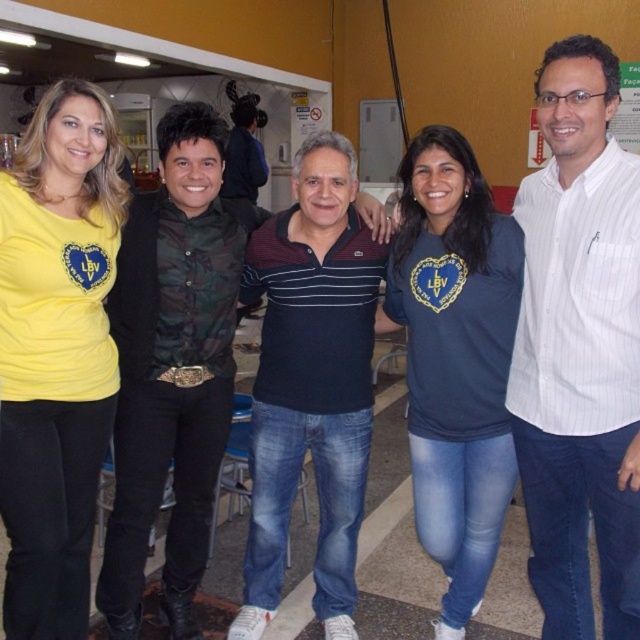
Question: In this image, where is white striped shirt at center located relative to yellow matte shirt at left?

Choices:
 (A) below
 (B) above

Answer: (B)

Question: Is white striped shirt at center wider than camouflage fabric shirt at left?

Choices:
 (A) yes
 (B) no

Answer: (B)

Question: Does camouflage fabric shirt at left appear on the left side of dark blue t-shirt at center?

Choices:
 (A) no
 (B) yes

Answer: (B)

Question: Which of the following is the closest to the observer?

Choices:
 (A) yellow matte shirt at left
 (B) camouflage fabric shirt at left

Answer: (A)

Question: Among these points, which one is farthest from the camera?

Choices:
 (A) coord(144,310)
 (B) coord(467,493)
 (C) coord(625,621)

Answer: (B)

Question: Which point is farther from the camera taking this photo?

Choices:
 (A) (513, 253)
 (B) (45, 253)
 (C) (605, 458)

Answer: (A)